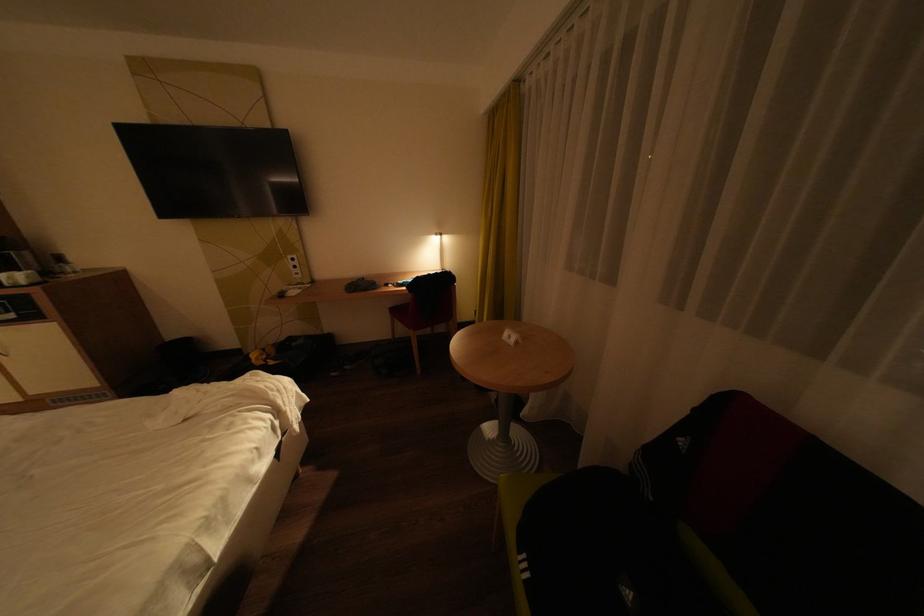
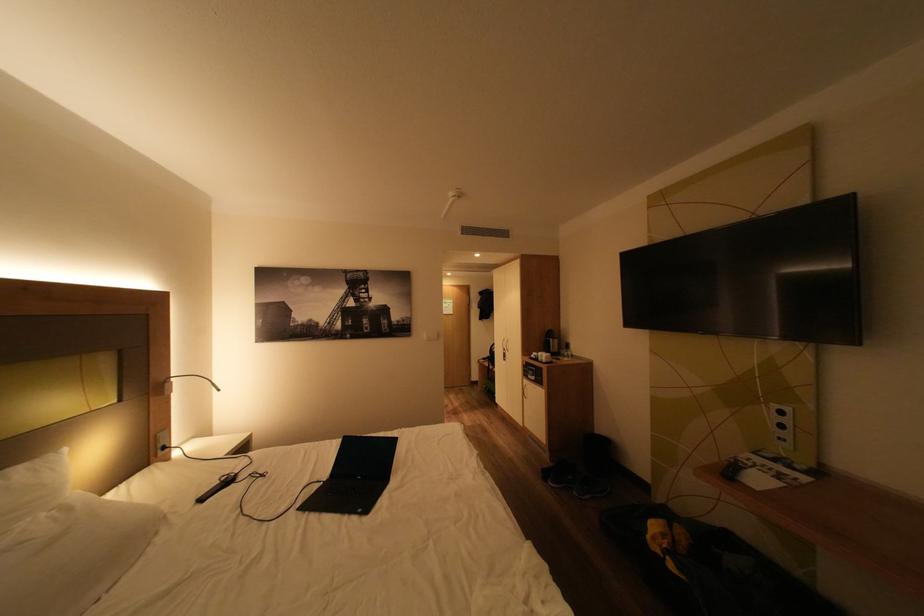
The point at (306, 267) is marked in the first image. Where is the corresponding point in the second image?

(793, 427)